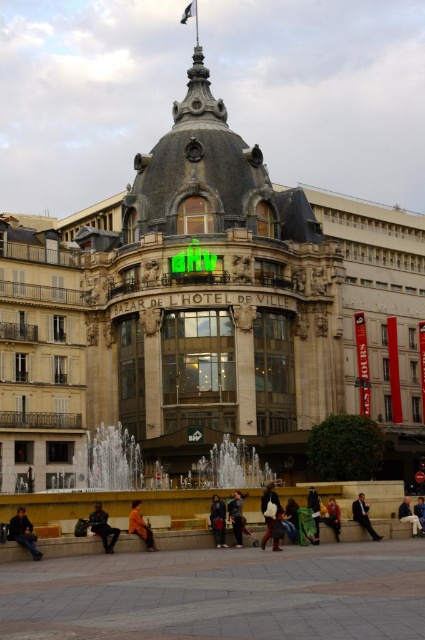
You are a fashion designer observing a busy street scene. You notice a person wearing a green fabric jacket at center and blue denim jeans at lower center. Which clothing item appears taller in the image?

The green fabric jacket at center is taller than the blue denim jeans at lower center.

You are a fashion designer observing people in the urban scene. You notice a dark gray suit at lower right and blue denim jeans at lower center. Which clothing item appears taller in the image?

The dark gray suit at lower right is much taller than the blue denim jeans at lower center.

What is the 2D coordinate of the dark blue jeans at lower center in the image?

The dark blue jeans at lower center is located at the 2D coordinate point of (218, 520).